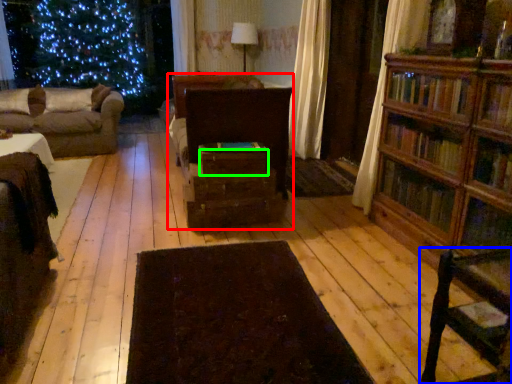
Question: Which object is the closest to the entertainment center (highlighted by a red box)? Choose among these: chair (highlighted by a blue box) or drawer (highlighted by a green box).

Choices:
 (A) chair
 (B) drawer

Answer: (B)